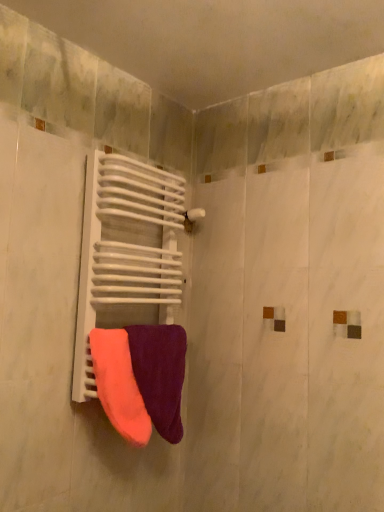
The image size is (384, 512). Describe the element at coordinates (160, 374) in the screenshot. I see `velvet purple towel at center, which appears as the second towel when viewed from the left` at that location.

In order to face velvet purple towel at center, acting as the 1th towel starting from the right, should I rotate leftwards or rightwards?

To face it directly, rotate left by 4.336 degrees.

Image resolution: width=384 pixels, height=512 pixels. What do you see at coordinates (126, 252) in the screenshot? I see `white matte radiator at center` at bounding box center [126, 252].

Find the location of `velvet purple towel at center, acting as the 1th towel starting from the right`. velvet purple towel at center, acting as the 1th towel starting from the right is located at coordinates (160, 374).

This screenshot has width=384, height=512. I want to click on towel above the velvet purple towel at center, acting as the 1th towel starting from the right (from a real-world perspective), so click(x=119, y=385).

From the image's perspective, is neon orange fabric towel at center, positioned as the first towel in left-to-right order, under velvet purple towel at center, which appears as the second towel when viewed from the left?

No.

Is neon orange fabric towel at center, positioned as the first towel in left-to-right order, thinner than velvet purple towel at center, which appears as the second towel when viewed from the left?

Yes, neon orange fabric towel at center, positioned as the first towel in left-to-right order, is thinner than velvet purple towel at center, which appears as the second towel when viewed from the left.

Between neon orange fabric towel at center, the 2th towel from the right, and velvet purple towel at center, which appears as the second towel when viewed from the left, which one appears on the right side from the viewer's perspective?

velvet purple towel at center, which appears as the second towel when viewed from the left.

Relative to white matte radiator at center, is velvet purple towel at center, acting as the 1th towel starting from the right, in front or behind?

velvet purple towel at center, acting as the 1th towel starting from the right, is behind white matte radiator at center.

What's the angular difference between velvet purple towel at center, which appears as the second towel when viewed from the left, and white matte radiator at center's facing directions?

There is a 14.9-degree angle between the facing directions of velvet purple towel at center, which appears as the second towel when viewed from the left, and white matte radiator at center.

Between velvet purple towel at center, which appears as the second towel when viewed from the left, and white matte radiator at center, which one has larger width?

white matte radiator at center.

In terms of size, does velvet purple towel at center, which appears as the second towel when viewed from the left, appear bigger or smaller than neon orange fabric towel at center, the 2th towel from the right?

Considering their sizes, velvet purple towel at center, which appears as the second towel when viewed from the left, takes up more space than neon orange fabric towel at center, the 2th towel from the right.

Is velvet purple towel at center, which appears as the second towel when viewed from the left, to the left or to the right of neon orange fabric towel at center, the 2th towel from the right, in the image?

From the image, it's evident that velvet purple towel at center, which appears as the second towel when viewed from the left, is to the right of neon orange fabric towel at center, the 2th towel from the right.

Which object is closer to the camera, velvet purple towel at center, acting as the 1th towel starting from the right, or neon orange fabric towel at center, the 2th towel from the right?

neon orange fabric towel at center, the 2th towel from the right, is in front.

Is velvet purple towel at center, acting as the 1th towel starting from the right, positioned with its back to neon orange fabric towel at center, the 2th towel from the right?

That's not correct — velvet purple towel at center, acting as the 1th towel starting from the right, is not looking away from neon orange fabric towel at center, the 2th towel from the right.

Considering the sizes of objects white matte radiator at center and neon orange fabric towel at center, positioned as the first towel in left-to-right order, in the image provided, who is taller, white matte radiator at center or neon orange fabric towel at center, positioned as the first towel in left-to-right order,?

white matte radiator at center.

What's the angular difference between white matte radiator at center and neon orange fabric towel at center, the 2th towel from the right,'s facing directions?

white matte radiator at center and neon orange fabric towel at center, the 2th towel from the right, are facing 14.9 degrees away from each other.

Could you measure the distance between white matte radiator at center and neon orange fabric towel at center, the 2th towel from the right?

The distance of white matte radiator at center from neon orange fabric towel at center, the 2th towel from the right, is 9.87 inches.

Is white matte radiator at center next to neon orange fabric towel at center, the 2th towel from the right, and touching it?

No, white matte radiator at center is not making contact with neon orange fabric towel at center, the 2th towel from the right.

From a real-world perspective, which is physically below, neon orange fabric towel at center, positioned as the first towel in left-to-right order, or white matte radiator at center?

neon orange fabric towel at center, positioned as the first towel in left-to-right order.

Considering the relative positions of neon orange fabric towel at center, positioned as the first towel in left-to-right order, and white matte radiator at center in the image provided, is neon orange fabric towel at center, positioned as the first towel in left-to-right order, to the left of white matte radiator at center from the viewer's perspective?

Indeed, neon orange fabric towel at center, positioned as the first towel in left-to-right order, is positioned on the left side of white matte radiator at center.

Does point (97, 378) appear closer or farther from the camera than point (90, 312)?

Point (97, 378) appears to be closer to the viewer than point (90, 312).

Where is `towel in front of the white matte radiator at center`? The width and height of the screenshot is (384, 512). towel in front of the white matte radiator at center is located at coordinates (119, 385).

Looking at this image, from a real-world perspective, which object stands above the other?

white matte radiator at center.

Does white matte radiator at center appear on the right side of velvet purple towel at center, which appears as the second towel when viewed from the left?

In fact, white matte radiator at center is to the left of velvet purple towel at center, which appears as the second towel when viewed from the left.

From the image's perspective, which one is positioned lower, white matte radiator at center or velvet purple towel at center, which appears as the second towel when viewed from the left?

velvet purple towel at center, which appears as the second towel when viewed from the left, from the image's perspective.

Locate an element on the screen. towel above the velvet purple towel at center, which appears as the second towel when viewed from the left (from a real-world perspective) is located at coordinates (119, 385).

Where is `radiator on the left side of velvet purple towel at center, which appears as the second towel when viewed from the left`? This screenshot has height=512, width=384. radiator on the left side of velvet purple towel at center, which appears as the second towel when viewed from the left is located at coordinates (126, 252).

Which object lies nearer to the anchor point velvet purple towel at center, acting as the 1th towel starting from the right, white matte radiator at center or neon orange fabric towel at center, the 2th towel from the right?

Based on the image, neon orange fabric towel at center, the 2th towel from the right, appears to be nearer to velvet purple towel at center, acting as the 1th towel starting from the right.

Which object lies nearer to the anchor point neon orange fabric towel at center, positioned as the first towel in left-to-right order, velvet purple towel at center, acting as the 1th towel starting from the right, or white matte radiator at center?

The object closer to neon orange fabric towel at center, positioned as the first towel in left-to-right order, is velvet purple towel at center, acting as the 1th towel starting from the right.

Based on their spatial positions, is neon orange fabric towel at center, the 2th towel from the right, or velvet purple towel at center, acting as the 1th towel starting from the right, closer to white matte radiator at center?

velvet purple towel at center, acting as the 1th towel starting from the right, lies closer to white matte radiator at center than the other object.

Based on their spatial positions, is velvet purple towel at center, acting as the 1th towel starting from the right, or neon orange fabric towel at center, positioned as the first towel in left-to-right order, further from white matte radiator at center?

Among the two, neon orange fabric towel at center, positioned as the first towel in left-to-right order, is located further to white matte radiator at center.

When comparing their distances from velvet purple towel at center, acting as the 1th towel starting from the right, does neon orange fabric towel at center, positioned as the first towel in left-to-right order, or white matte radiator at center seem further?

white matte radiator at center is positioned further to the anchor velvet purple towel at center, acting as the 1th towel starting from the right.

When comparing their distances from neon orange fabric towel at center, positioned as the first towel in left-to-right order, does white matte radiator at center or velvet purple towel at center, which appears as the second towel when viewed from the left, seem further?

white matte radiator at center is further to neon orange fabric towel at center, positioned as the first towel in left-to-right order.

This screenshot has height=512, width=384. Identify the location of towel between white matte radiator at center and velvet purple towel at center, which appears as the second towel when viewed from the left, in the up-down direction. (119, 385).